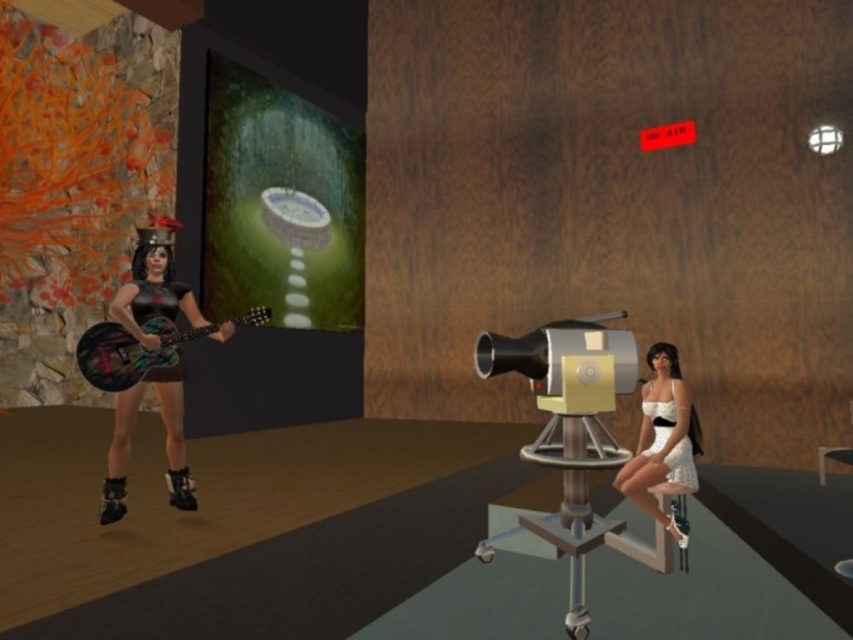
Can you confirm if matte black guitar at left is positioned above white satin dress at center?

Indeed, matte black guitar at left is positioned over white satin dress at center.

What do you see at coordinates (165, 442) in the screenshot? The width and height of the screenshot is (853, 640). I see `matte black guitar at left` at bounding box center [165, 442].

Is point (189, 502) farther from viewer compared to point (666, 481)?

Yes, it is behind point (666, 481).

Identify the location of matte black guitar at left. The height and width of the screenshot is (640, 853). (165, 442).

The height and width of the screenshot is (640, 853). What do you see at coordinates (677, 468) in the screenshot?
I see `white satin dress at lower right` at bounding box center [677, 468].

Can you confirm if white satin dress at lower right is positioned below wooden stool at lower right?

Actually, white satin dress at lower right is above wooden stool at lower right.

Measure the distance between point (x=683, y=460) and camera.

The distance of point (x=683, y=460) from camera is 13.28 feet.

This screenshot has width=853, height=640. In order to click on white satin dress at lower right in this screenshot , I will do `click(677, 468)`.

Who is more distant from viewer, [643,397] or [844,452]?

The point [643,397] is more distant.

Who is shorter, white satin dress at center or wooden stool at lower right?

wooden stool at lower right is shorter.

The width and height of the screenshot is (853, 640). What do you see at coordinates (663, 440) in the screenshot?
I see `white satin dress at center` at bounding box center [663, 440].

This screenshot has width=853, height=640. I want to click on white satin dress at center, so click(663, 440).